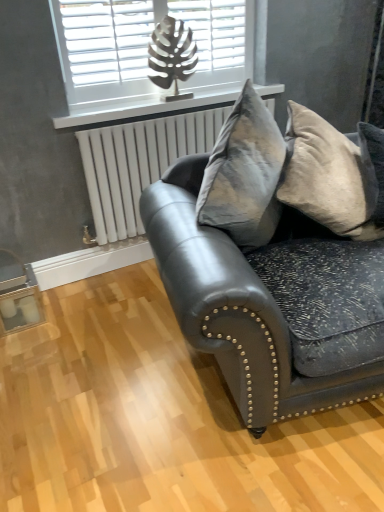
The height and width of the screenshot is (512, 384). Describe the element at coordinates (139, 163) in the screenshot. I see `white metallic radiator at upper center` at that location.

In order to click on white matte window at upper center in this screenshot , I will do `click(147, 46)`.

Where is `velvet gray pillow at right`? This screenshot has width=384, height=512. velvet gray pillow at right is located at coordinates (334, 175).

Measure the distance between white plastic radiator at upper center and camera.

The distance of white plastic radiator at upper center from camera is 2.06 meters.

Find the location of a particular element. The height and width of the screenshot is (512, 384). matte black leather couch at center is located at coordinates (278, 259).

Is matte black leather couch at center in front of or behind white matte window at upper center in the image?

In the image, matte black leather couch at center appears in front of white matte window at upper center.

Based on the photo, from the image's perspective, would you say matte black leather couch at center is positioned over white matte window at upper center?

No, from the image's perspective, matte black leather couch at center is not over white matte window at upper center.

The image size is (384, 512). Find the location of `studio couch below the white matte window at upper center (from the image's perspective)`. studio couch below the white matte window at upper center (from the image's perspective) is located at coordinates (278, 259).

Is matte black leather couch at center to the left or to the right of white matte window at upper center in the image?

From the image, it's evident that matte black leather couch at center is to the right of white matte window at upper center.

Which of these two, white metallic radiator at upper center or white matte window at upper center, is wider?

white metallic radiator at upper center is wider.

Is white metallic radiator at upper center turned away from white matte window at upper center?

No, white metallic radiator at upper center is not facing away from white matte window at upper center.

From a real-world perspective, who is located higher, white metallic radiator at upper center or white matte window at upper center?

white matte window at upper center is physically above.

Can you confirm if white metallic radiator at upper center is positioned to the right of white matte window at upper center?

Indeed, white metallic radiator at upper center is positioned on the right side of white matte window at upper center.

From the image's perspective, does matte black leather couch at center appear lower than velvet gray pillow at right?

Yes, from the image's perspective, matte black leather couch at center is below velvet gray pillow at right.

From a real-world perspective, who is located lower, matte black leather couch at center or velvet gray pillow at right?

From a 3D spatial view, matte black leather couch at center is below.

Considering the sizes of matte black leather couch at center and velvet gray pillow at right in the image, is matte black leather couch at center taller or shorter than velvet gray pillow at right?

Considering their sizes, matte black leather couch at center has more height than velvet gray pillow at right.

From the image's perspective, which one is positioned lower, white matte window at upper center or white plastic radiator at upper center?

white plastic radiator at upper center is shown below in the image.

Does white matte window at upper center come in front of white plastic radiator at upper center?

Yes, white matte window at upper center is closer to the viewer.

Is white matte window at upper center aimed at white plastic radiator at upper center?

No, white matte window at upper center does not turn towards white plastic radiator at upper center.

Is white matte window at upper center in contact with white plastic radiator at upper center?

No, white matte window at upper center is not in contact with white plastic radiator at upper center.

Is white matte window at upper center positioned with its back to velvet gray pillow at right?

No, white matte window at upper center's orientation is not away from velvet gray pillow at right.

This screenshot has height=512, width=384. Find the location of `pillow beneath the white matte window at upper center (from a real-world perspective)`. pillow beneath the white matte window at upper center (from a real-world perspective) is located at coordinates (334, 175).

Is white matte window at upper center bigger than velvet gray pillow at right?

Incorrect, white matte window at upper center is not larger than velvet gray pillow at right.

Is white matte window at upper center next to velvet gray pillow at right and touching it?

No, white matte window at upper center is not beside velvet gray pillow at right.

Image resolution: width=384 pixels, height=512 pixels. In order to click on window sill that appears on the right of white matte window at upper center in this screenshot , I will do `click(144, 109)`.

Does white plastic radiator at upper center touch white matte window at upper center?

No, white plastic radiator at upper center is not in contact with white matte window at upper center.

Is white plastic radiator at upper center turned away from white matte window at upper center?

white plastic radiator at upper center does not have its back to white matte window at upper center.

Between white plastic radiator at upper center and white matte window at upper center, which one appears on the right side from the viewer's perspective?

white plastic radiator at upper center is more to the right.

Which is more to the right, velvet gray pillow at right or matte black leather couch at center?

Positioned to the right is matte black leather couch at center.

Is velvet gray pillow at right taller or shorter than matte black leather couch at center?

Clearly, velvet gray pillow at right is shorter compared to matte black leather couch at center.

From the image's perspective, is velvet gray pillow at right positioned above or below matte black leather couch at center?

Based on their image positions, velvet gray pillow at right is located above matte black leather couch at center.

Consider the image. Is velvet gray pillow at right not inside matte black leather couch at center?

Actually, velvet gray pillow at right is within matte black leather couch at center.

At what (x,y) coordinates should I click in order to perform the action: click on studio couch in front of the white matte window at upper center. Please return your answer as a coordinate pair (x, y). Looking at the image, I should click on (278, 259).

The height and width of the screenshot is (512, 384). In order to click on radiator below the white matte window at upper center (from the image's perspective) in this screenshot , I will do `click(139, 163)`.

When comparing their distances from white metallic radiator at upper center, does matte black leather couch at center or white plastic radiator at upper center seem closer?

Based on the image, white plastic radiator at upper center appears to be nearer to white metallic radiator at upper center.

Which object lies further to the anchor point white matte window at upper center, white plastic radiator at upper center or matte black leather couch at center?

matte black leather couch at center lies further to white matte window at upper center than the other object.

Considering their positions, is white metallic radiator at upper center positioned further to velvet gray pillow at right than white matte window at upper center?

The object further to velvet gray pillow at right is white matte window at upper center.

Considering their positions, is matte black leather couch at center positioned closer to white matte window at upper center than white plastic radiator at upper center?

Based on the image, white plastic radiator at upper center appears to be nearer to white matte window at upper center.

Looking at this image, looking at the image, which one is located further to matte black leather couch at center, white metallic radiator at upper center or velvet gray pillow at right?

Based on the image, white metallic radiator at upper center appears to be further to matte black leather couch at center.

Based on their spatial positions, is velvet gray pillow at right or white matte window at upper center closer to white plastic radiator at upper center?

white matte window at upper center lies closer to white plastic radiator at upper center than the other object.

When comparing their distances from velvet gray pillow at right, does white plastic radiator at upper center or matte black leather couch at center seem further?

Among the two, white plastic radiator at upper center is located further to velvet gray pillow at right.

Considering their positions, is white metallic radiator at upper center positioned closer to white matte window at upper center than matte black leather couch at center?

white metallic radiator at upper center is closer to white matte window at upper center.

At what (x,y) coordinates should I click in order to perform the action: click on pillow between matte black leather couch at center and white metallic radiator at upper center from front to back. Please return your answer as a coordinate pair (x, y). This screenshot has width=384, height=512. Looking at the image, I should click on (334, 175).

Where is `window sill between white matte window at upper center and velvet gray pillow at right vertically`? The image size is (384, 512). window sill between white matte window at upper center and velvet gray pillow at right vertically is located at coordinates (144, 109).

Locate an element on the screen. The image size is (384, 512). pillow between matte black leather couch at center and white plastic radiator at upper center from front to back is located at coordinates (334, 175).

Where is `window sill between velvet gray pillow at right and white metallic radiator at upper center from front to back`? window sill between velvet gray pillow at right and white metallic radiator at upper center from front to back is located at coordinates (144, 109).